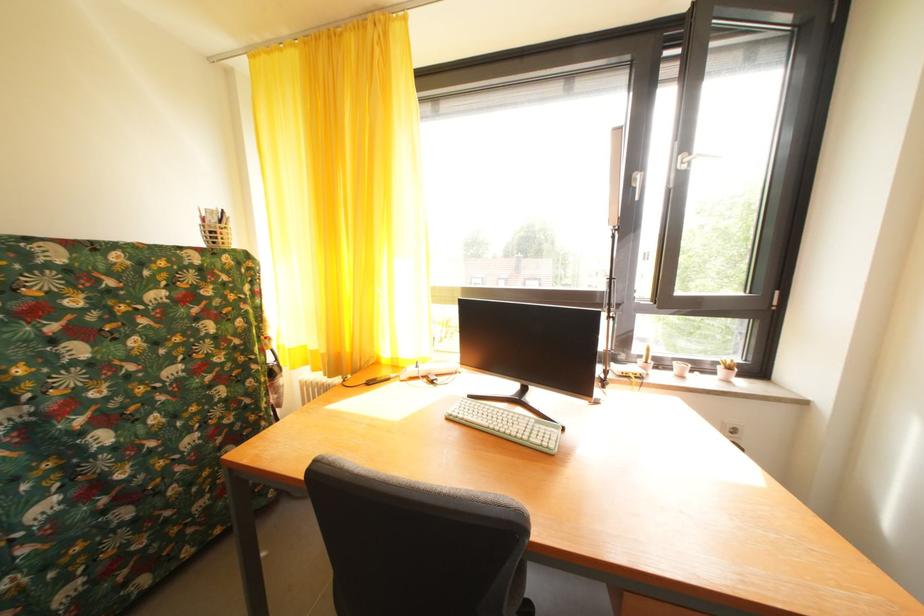
The location [506,424] corresponds to which object?

This point indicates the light green keyboard.